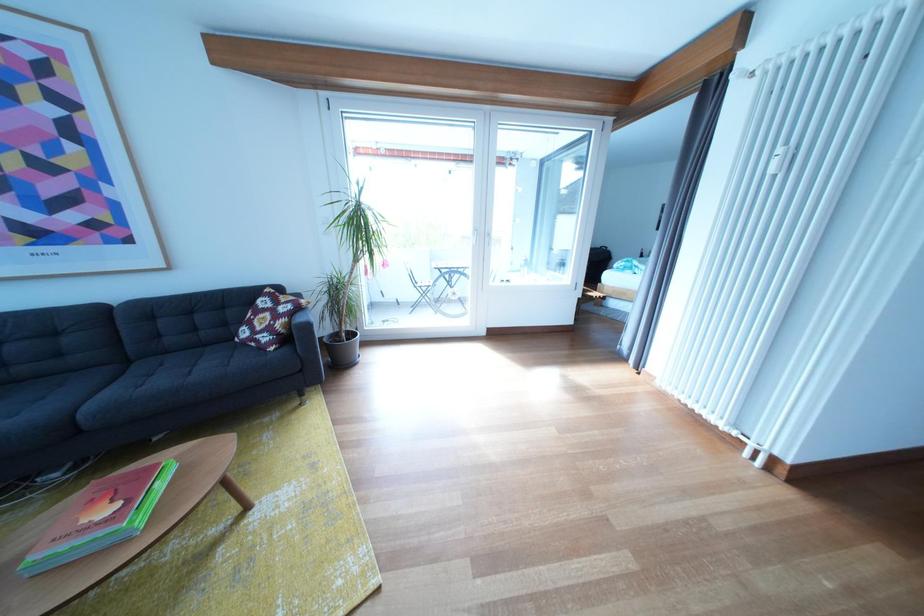
What do you see at coordinates (106, 528) in the screenshot? I see `the red cover book` at bounding box center [106, 528].